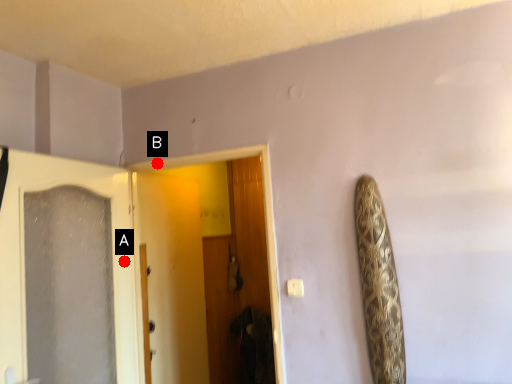
Question: Two points are circled on the image, labeled by A and B beside each circle. Which point is further to the camera?

Choices:
 (A) A is further
 (B) B is further

Answer: (B)